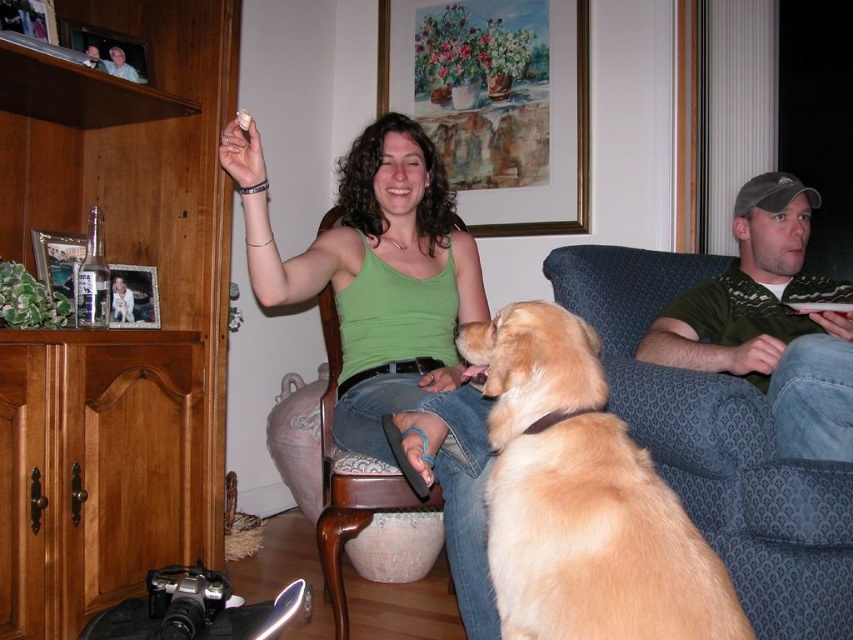
You are trying to decide whether to place a new decorative pillow on the green sweater at right or the wooden chair at center. Based on their sizes, which object would be a better fit for placing the pillow?

The wooden chair at center is larger than the green sweater at right, so the wooden chair at center would be a better fit for placing the decorative pillow.